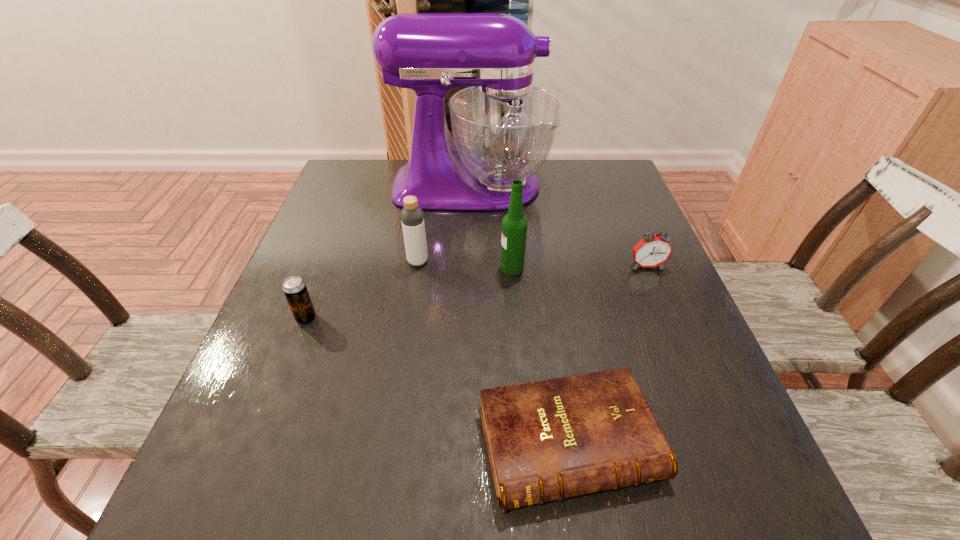
Locate an element on the screen. The image size is (960, 540). free space between the shortest object and the third tallest object is located at coordinates (493, 353).

Where is `free space between the fourth shortest object and the second nearest object`? The width and height of the screenshot is (960, 540). free space between the fourth shortest object and the second nearest object is located at coordinates (362, 289).

Identify the location of vacant area that lies between the beer bottle and the rightmost object. Image resolution: width=960 pixels, height=540 pixels. (579, 266).

Where is `empty space between the nearest object and the fifth shortest object`? This screenshot has height=540, width=960. empty space between the nearest object and the fifth shortest object is located at coordinates (540, 355).

This screenshot has height=540, width=960. What are the coordinates of `unoccupied area between the rightmost object and the second tallest object` in the screenshot? It's located at (579, 266).

Locate an element on the screen. This screenshot has height=540, width=960. free point between the second nearest object and the fourth shortest object is located at coordinates (x=362, y=289).

The height and width of the screenshot is (540, 960). I want to click on vacant space in between the rightmost object and the fifth shortest object, so 579,266.

Where is `object that stands as the fifth closest to the third tallest object`? The width and height of the screenshot is (960, 540). object that stands as the fifth closest to the third tallest object is located at coordinates (651, 251).

Locate which object ranks fifth in proximity to the fifth farthest object. Please provide its 2D coordinates. Your answer should be formatted as a tuple, i.e. [(x, y)], where the tuple contains the x and y coordinates of a point satisfying the conditions above.

[(651, 251)]

The width and height of the screenshot is (960, 540). What are the coordinates of `vacant region that satisfies the following two spatial constraints: 1. at the bowl opening of the mixer; 2. on the front side of the beer can` in the screenshot? It's located at (468, 318).